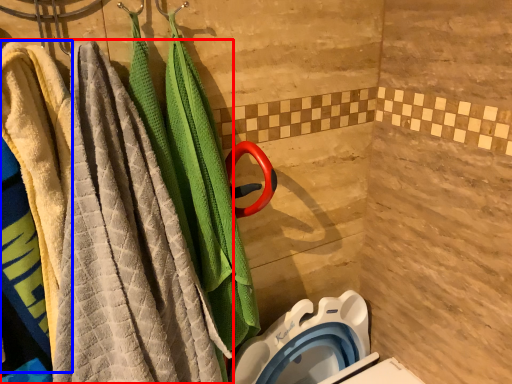
Question: Which object is further to the camera taking this photo, towel (highlighted by a red box) or beach towel (highlighted by a blue box)?

Choices:
 (A) towel
 (B) beach towel

Answer: (B)